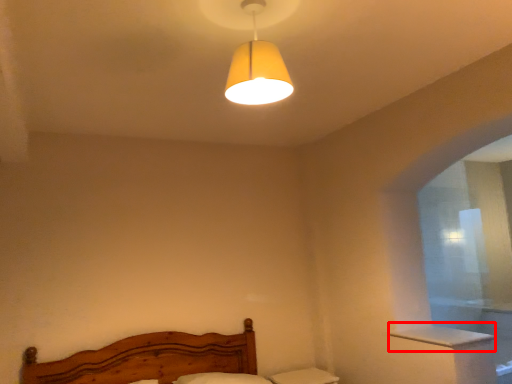
Question: Observing the image, what is the correct spatial positioning of window sill (annotated by the red box) in reference to lamp?

Choices:
 (A) left
 (B) right

Answer: (B)